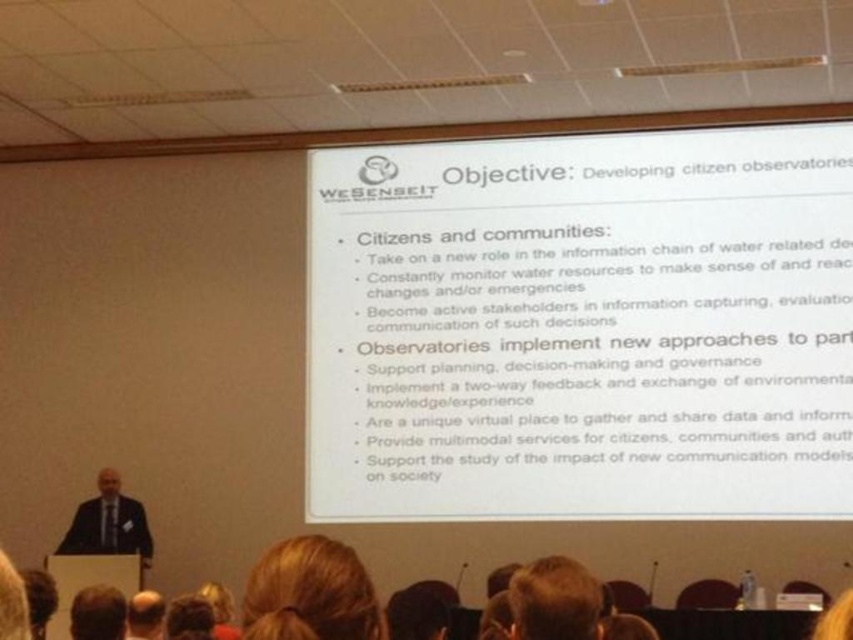
Question: Which object is farther from the camera taking this photo?

Choices:
 (A) brown hair at lower left
 (B) white paper at center

Answer: (B)

Question: Can you confirm if white paper at center is positioned above brown hair at lower left?

Choices:
 (A) no
 (B) yes

Answer: (B)

Question: Among these objects, which one is farthest from the camera?

Choices:
 (A) blonde hair at lower center
 (B) blonde hair at upper center
 (C) white paper at center
 (D) dark suit at lower left

Answer: (C)

Question: In this image, where is dark suit at lower left located relative to brown hair at upper center?

Choices:
 (A) right
 (B) left

Answer: (B)

Question: Among these points, which one is nearest to the camera?

Choices:
 (A) (86, 628)
 (B) (164, 628)

Answer: (A)

Question: Can you confirm if white paper at center is positioned above dark suit at lower left?

Choices:
 (A) yes
 (B) no

Answer: (A)